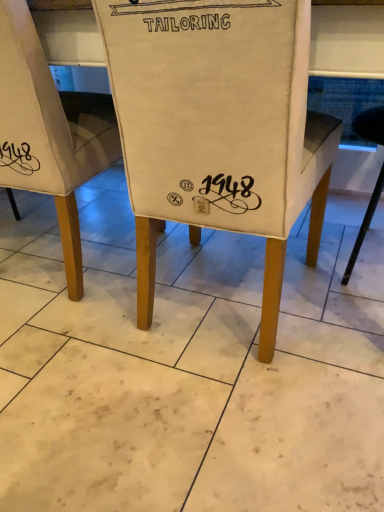
Question: Is canvas chair at center, marked as the first chair in a right-to-left arrangement, wider or thinner than white fabric chair at center, the 1th chair viewed from the left?

Choices:
 (A) wide
 (B) thin

Answer: (A)

Question: From a real-world perspective, relative to white fabric chair at center, which is the 2th chair in right-to-left order, is canvas chair at center, which is the second chair from left to right, vertically above or below?

Choices:
 (A) above
 (B) below

Answer: (B)

Question: In the image, is canvas chair at center, which is the second chair from left to right, positioned in front of or behind white fabric chair at center, the 1th chair viewed from the left?

Choices:
 (A) front
 (B) behind

Answer: (A)

Question: Is white fabric chair at center, which is the 2th chair in right-to-left order, wider or thinner than canvas chair at center, which is the second chair from left to right?

Choices:
 (A) thin
 (B) wide

Answer: (A)

Question: Is point (38, 98) closer or farther from the camera than point (233, 104)?

Choices:
 (A) closer
 (B) farther

Answer: (B)

Question: Based on their sizes in the image, would you say white fabric chair at center, the 1th chair viewed from the left, is bigger or smaller than canvas chair at center, marked as the first chair in a right-to-left arrangement?

Choices:
 (A) small
 (B) big

Answer: (A)

Question: Relative to canvas chair at center, which is the second chair from left to right, is white fabric chair at center, the 1th chair viewed from the left, in front or behind?

Choices:
 (A) front
 (B) behind

Answer: (B)